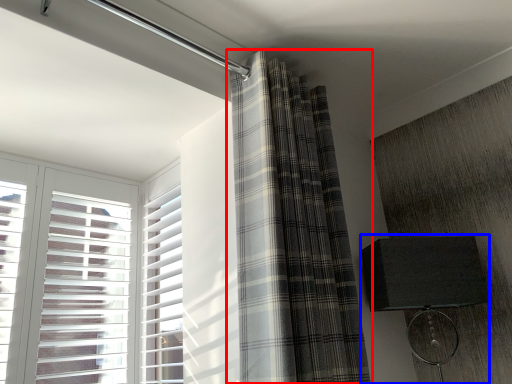
Question: Which object appears farthest to the camera in this image, curtain (highlighted by a red box) or table lamp (highlighted by a blue box)?

Choices:
 (A) curtain
 (B) table lamp

Answer: (B)